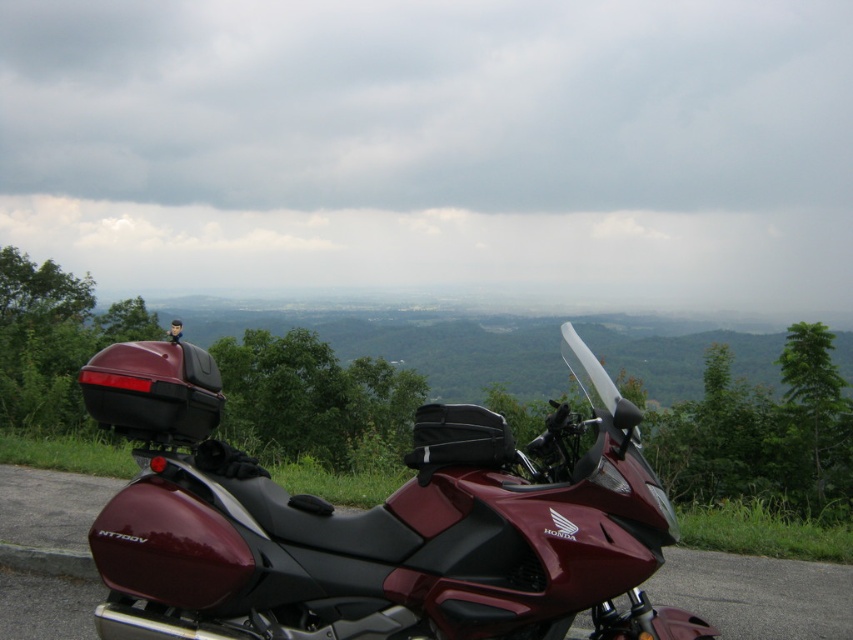
You are standing at the point with coordinates (376, 524) in the image. What object are you directly facing?

The point at (376, 524) indicates you are directly facing the maroon matte motorcycle at center.

You are planning to take a road trip and need to park two motorcycles, the maroon matte motorcycle at center and the glossy maroon motorcycle at center, side by side along a narrow road. The road is only 10 feet wide. Can both motorcycles fit without overlapping?

The distance between the maroon matte motorcycle at center and glossy maroon motorcycle at center is 8.73 feet. Since the road is 10 feet wide, there is enough space to park both motorcycles side by side as 8.73 feet is less than 10 feet.

You are a drone operator planning to take a photo of the maroon matte motorcycle at center. The drone is currently at coordinates 0.5, 0.5. To reach the motorcycle, in which direction should the drone move horizontally? Please specify left or right.

The maroon matte motorcycle at center is located at coordinates (376,524). Since the drone is at (426,320), it needs to move to the right horizontally to reach the motorcycle.